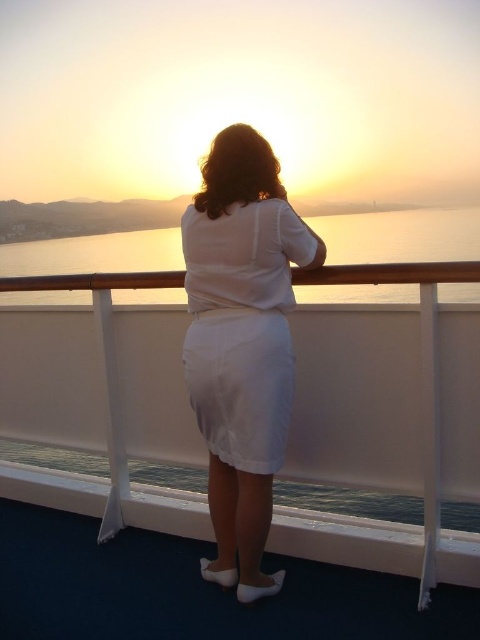
You are a photographer positioned at the center of the ship deck. You want to capture a photo of the white satin skirt at center. Based on its position coordinates, is the skirt located to your left, right, front, or directly in front of you?

The white satin skirt at center is located at coordinates point (241, 342). Since the center of the ship deck is the reference point, the skirt is directly in front of you.

From the picture: You are a photographer positioned on the ship deck. You want to capture a photo of the sunset with both the white satin skirt at center and the matte water at center in the frame. Which object should you position closer to the left side of the camera frame to include both in the shot?

To include both the white satin skirt at center and the matte water at center in the shot, position the matte water at center closer to the left side of the camera frame since the white satin skirt at center is to the right of the matte water at center.

You are a photographer trying to capture the sunset scene. You notice a point marked at coordinates (241,342) in the image. Based on the scene description, what object is located at that point?

The point at coordinates (241,342) indicates the location of the white satin skirt at center.